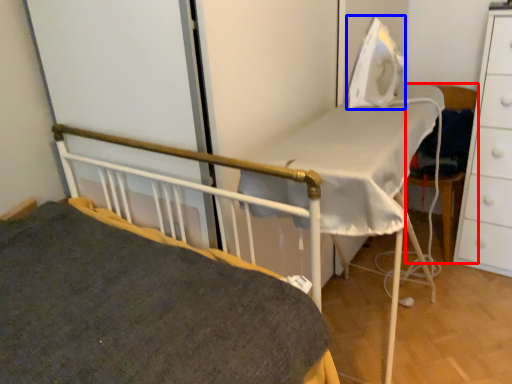
Question: Which object appears closest to the camera in this image, chair (highlighted by a red box) or equipment (highlighted by a blue box)?

Choices:
 (A) chair
 (B) equipment

Answer: (B)